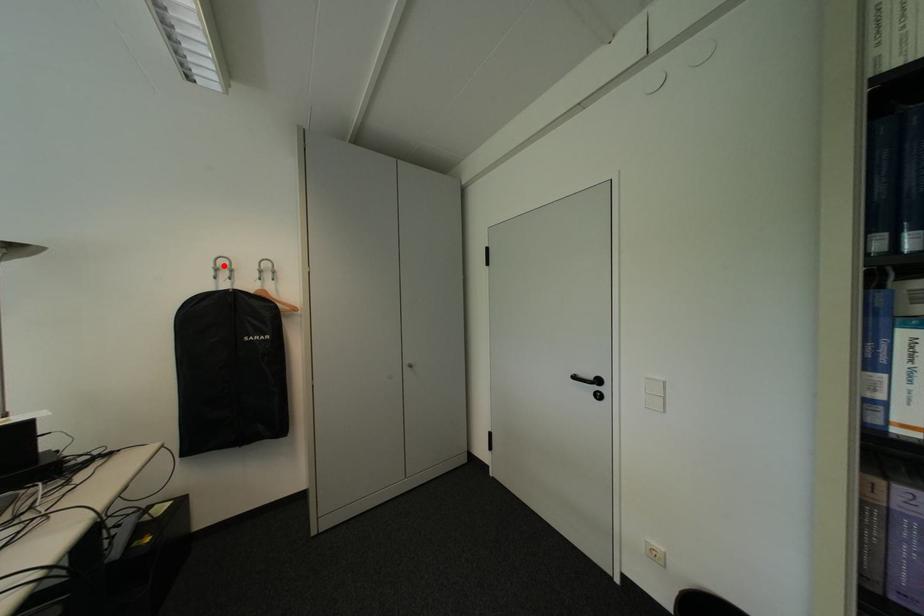
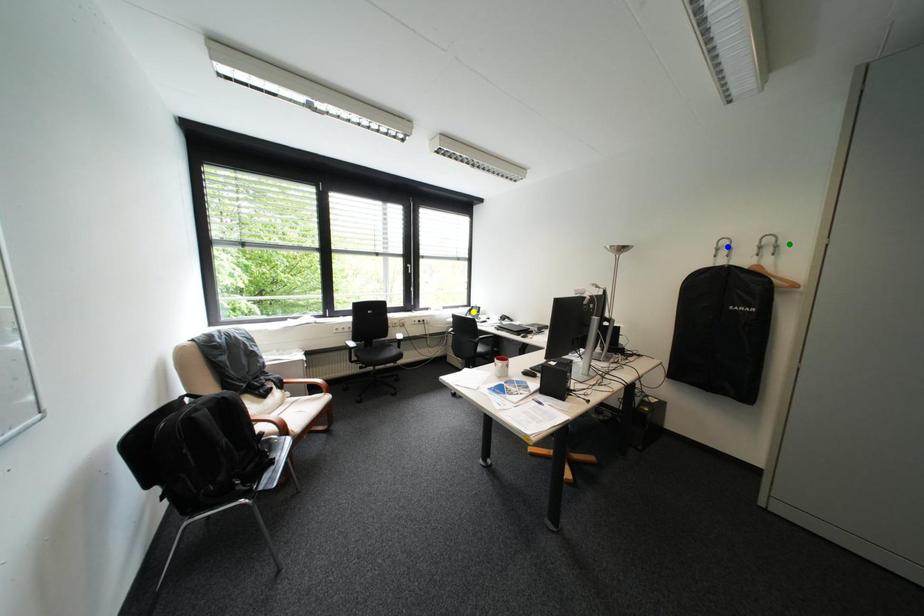
Question: I am providing you with two images of the same scene from different viewpoints. A red point is marked on the first image. You are given multiple points on the second image. Can you choose the point in image 2 that corresponds to the point in image 1?

Choices:
 (A) green point
 (B) yellow point
 (C) blue point

Answer: (C)